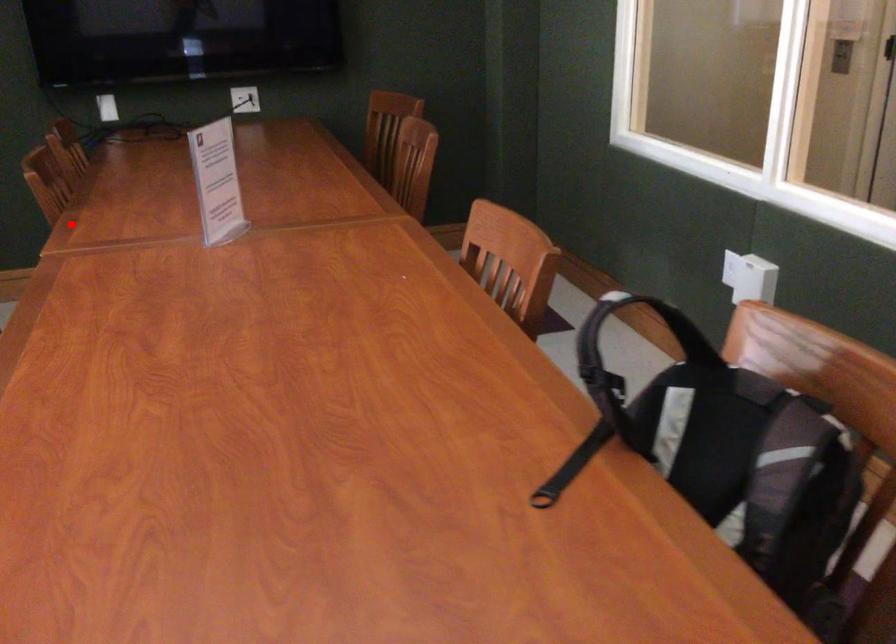
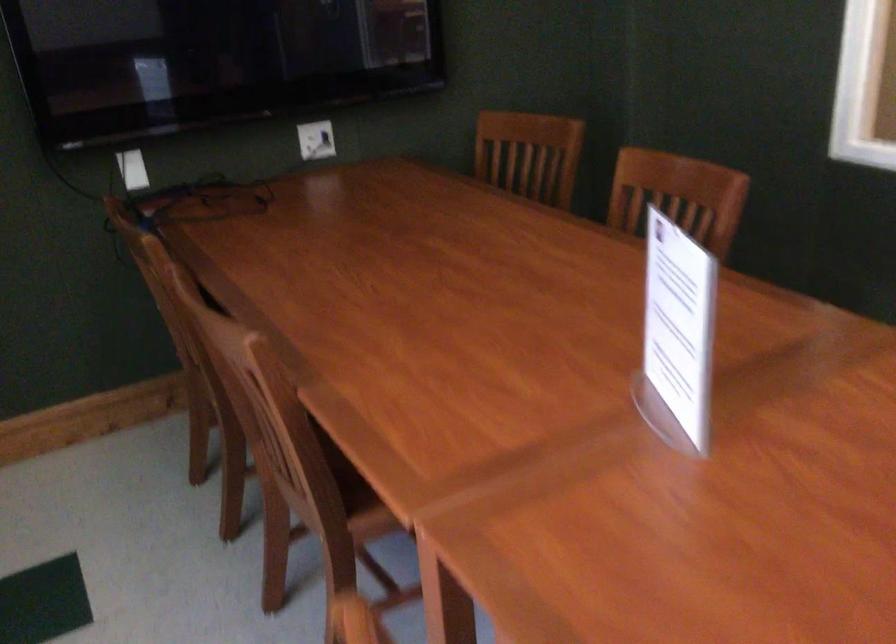
Find the pixel in the second image that matches the highlighted location in the first image.

(299, 413)